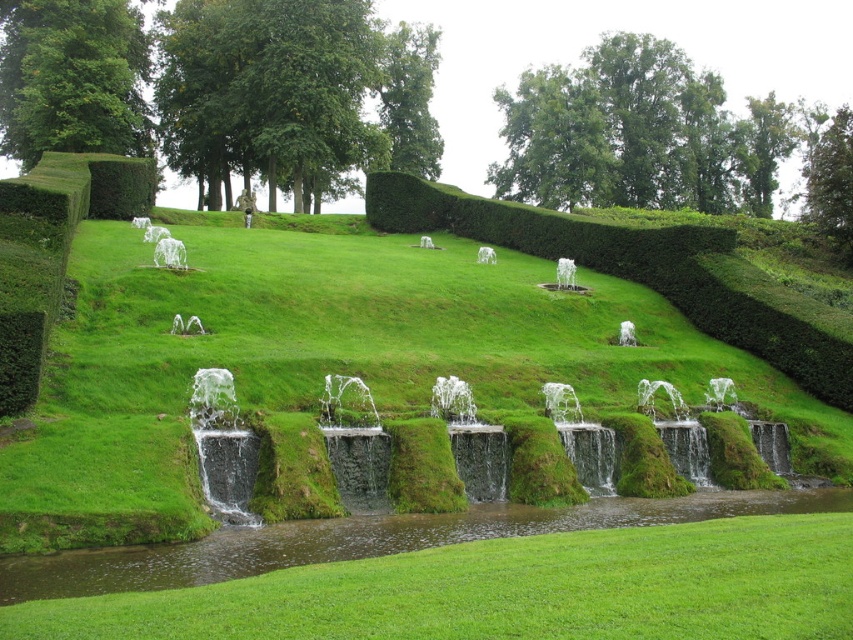
You are a gardener who needs to mow the lawn. You see the green mossy grass at center and the green leafy hedge at upper center. Which one is shorter and requires mowing?

The green mossy grass at center is not as tall as the green leafy hedge at upper center, so the green mossy grass at center is shorter and requires mowing.

You are standing in the garden and see the green mossy grass at center and the green mossy stone at center. Which object is located to the left of the other?

The green mossy grass at center is positioned on the left side of green mossy stone at center.